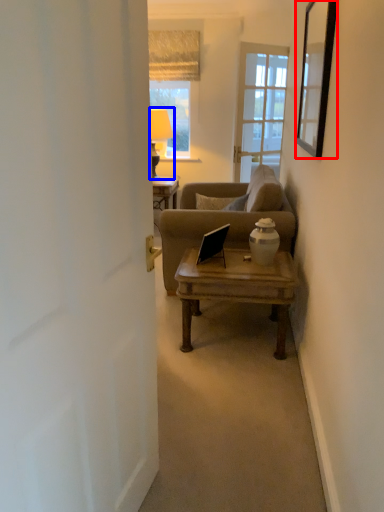
Question: Which point is closer to the camera, picture frame (highlighted by a red box) or lamp (highlighted by a blue box)?

Choices:
 (A) picture frame
 (B) lamp

Answer: (A)